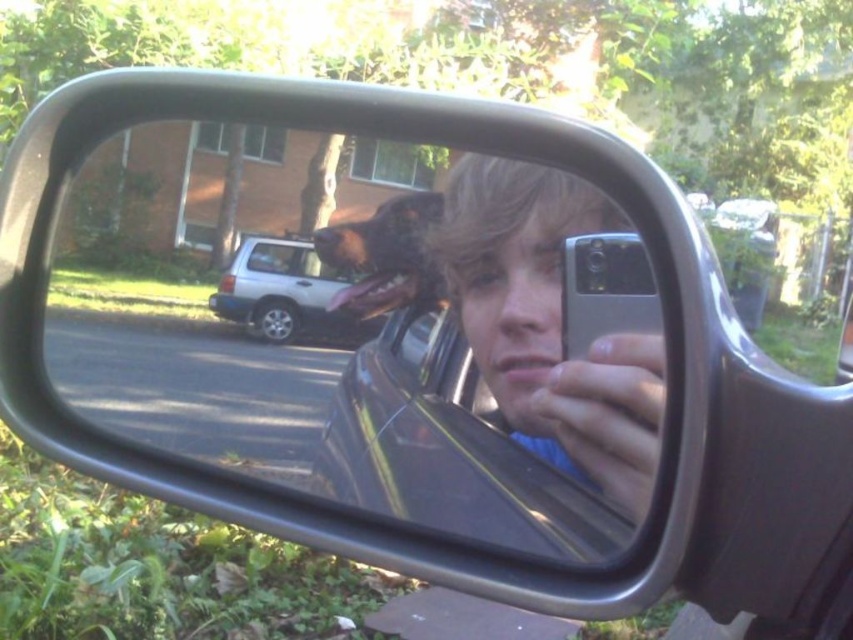
Question: Can you confirm if matte silver phone at center is wider than clear glass car window at center?

Choices:
 (A) no
 (B) yes

Answer: (B)

Question: Which of the following is the farthest from the observer?

Choices:
 (A) (378, 241)
 (B) (476, 301)
 (C) (245, 314)
 (D) (289, 252)

Answer: (C)

Question: Which point is closer to the camera taking this photo?

Choices:
 (A) (254, 266)
 (B) (426, 252)

Answer: (B)

Question: Can you confirm if matte silver phone at center is bigger than white matte suv at center?

Choices:
 (A) yes
 (B) no

Answer: (A)

Question: Is matte silver phone at center to the right of brown furry dog at center from the viewer's perspective?

Choices:
 (A) no
 (B) yes

Answer: (B)

Question: Among these objects, which one is farthest from the camera?

Choices:
 (A) white matte suv at center
 (B) clear glass car window at center
 (C) brown furry dog at center

Answer: (B)